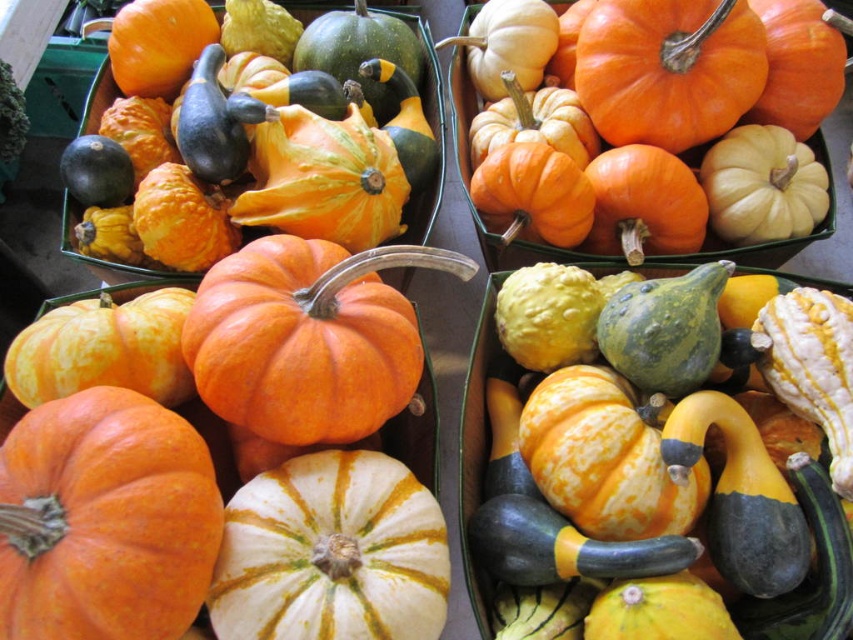
Is orange matte pumpkin at lower left thinner than orange matte pumpkin at upper left?

Yes.

Describe the element at coordinates (107, 520) in the screenshot. This screenshot has height=640, width=853. I see `orange matte pumpkin at lower left` at that location.

Find the location of a particular element. Image resolution: width=853 pixels, height=640 pixels. orange matte pumpkin at lower left is located at coordinates (107, 520).

Can you confirm if orange matte pumpkin at lower left is wider than orange matte pumpkin at upper right?

Incorrect, orange matte pumpkin at lower left's width does not surpass orange matte pumpkin at upper right's.

Between orange matte pumpkin at lower left and orange matte pumpkin at upper right, which one has more height?

orange matte pumpkin at upper right is taller.

This screenshot has width=853, height=640. What are the coordinates of `orange matte pumpkin at lower left` in the screenshot? It's located at (107, 520).

Looking at this image, between white matte pumpkin at center and orange matte pumpkin at upper right, which one appears on the left side from the viewer's perspective?

white matte pumpkin at center is more to the left.

Who is shorter, white matte pumpkin at center or orange matte pumpkin at upper right?

Standing shorter between the two is white matte pumpkin at center.

Which is behind, point (283, 593) or point (558, 12)?

The point (558, 12) is behind.

The height and width of the screenshot is (640, 853). I want to click on white matte pumpkin at center, so click(x=331, y=554).